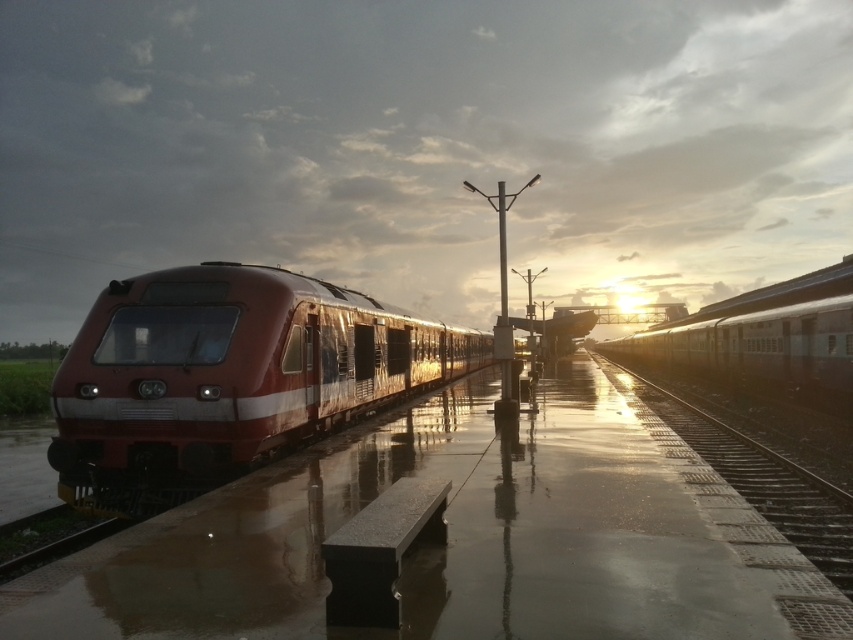
You are a photographer planning to take a photo of the metallic red train at left and the silver metallic train at upper right. Based on their sizes in the image, which train should you focus on to ensure it takes up more of the frame?

The silver metallic train at upper right should be focused on because it occupies more space in the image than the metallic red train at left.

You are a photographer wanting to capture the shiny red train at left and the metallic train track at right in a single frame. Given their sizes, which object will appear bigger in your photo?

The shiny red train at left will appear bigger in the photo because it is larger in size than the metallic train track at right.